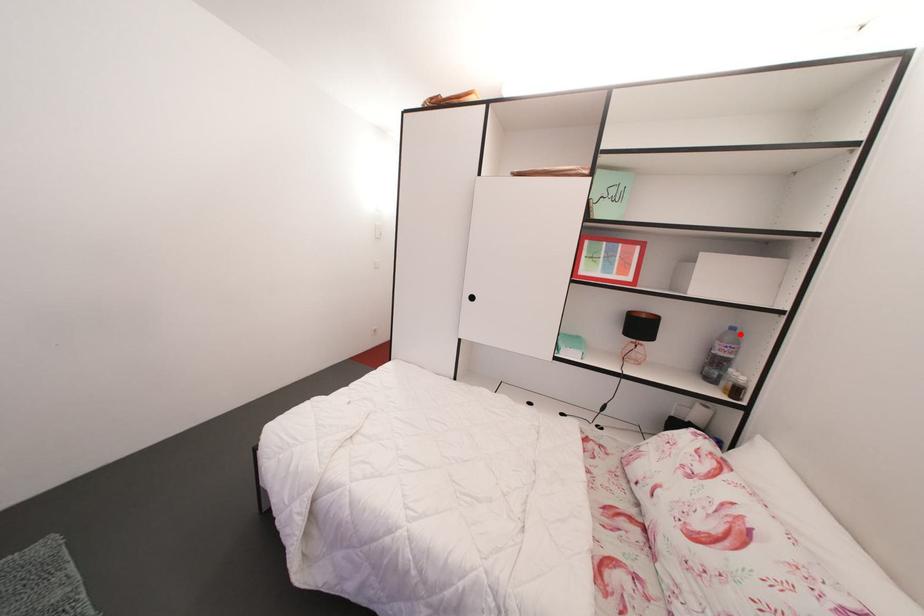
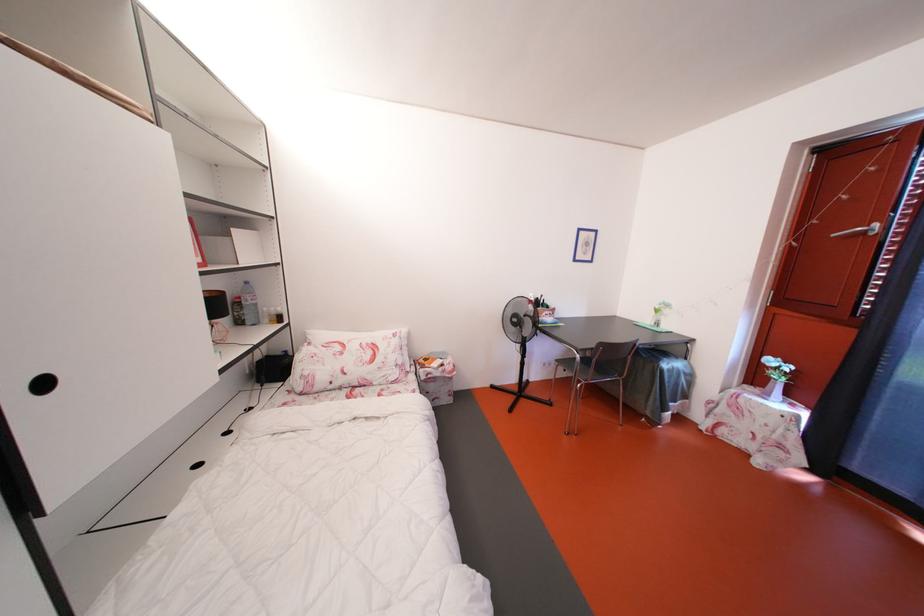
Question: I am providing you with two images of the same scene from different viewpoints. A red point is marked on the first image. Can you still see the location of the red point in image 2?

Choices:
 (A) Yes
 (B) No

Answer: (A)